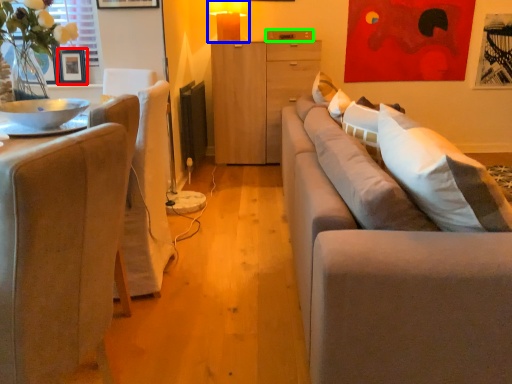
Question: Which object is positioned farthest from picture frame (highlighted by a red box)? Select from table lamp (highlighted by a blue box) and drawer (highlighted by a green box).

Choices:
 (A) table lamp
 (B) drawer

Answer: (B)